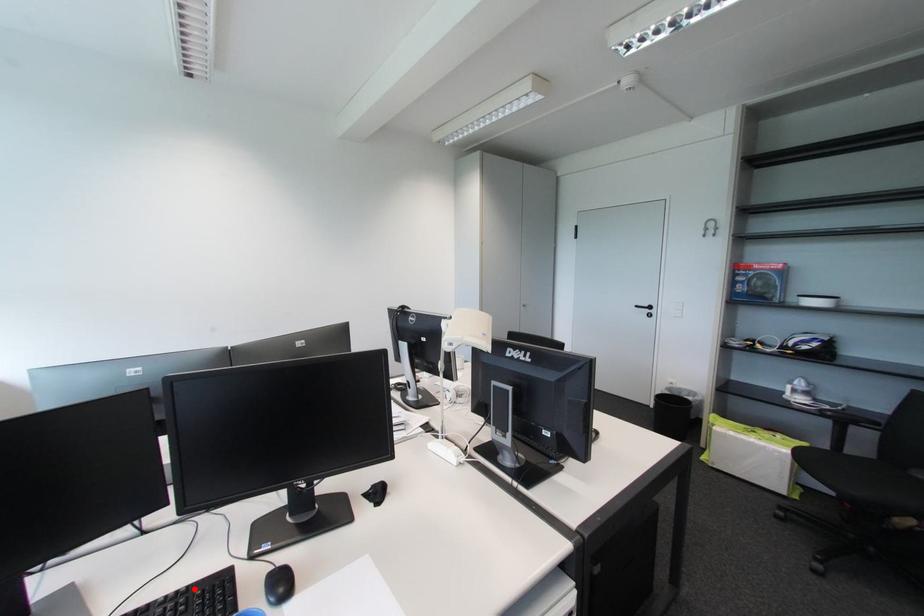
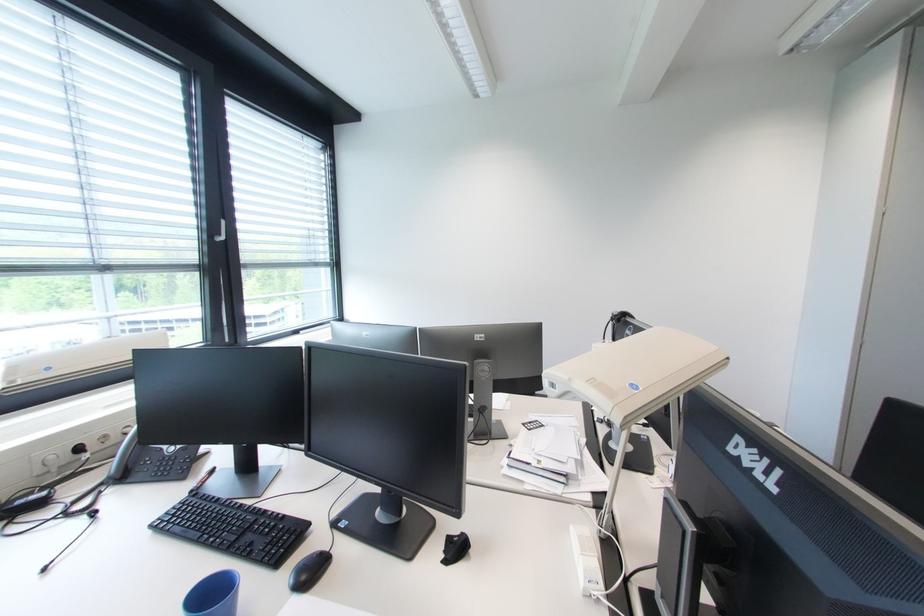
Locate, in the second image, the point that corresponds to the highlighted location in the first image.

(290, 517)